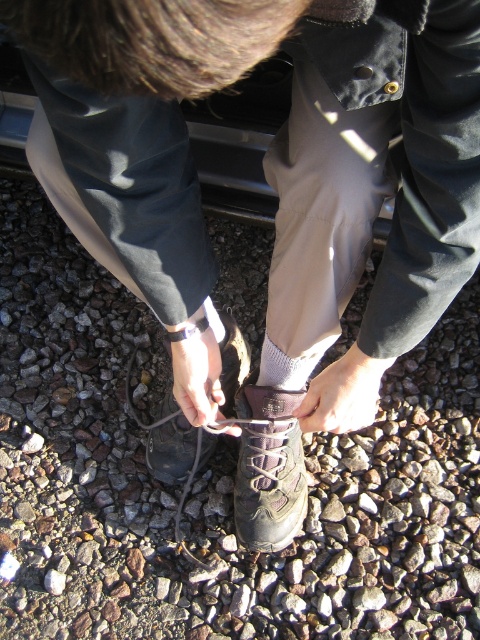
Question: Can you confirm if gray gravel at center is positioned to the left of metallic gray car at center?

Choices:
 (A) no
 (B) yes

Answer: (B)

Question: Which of the following is the closest to the observer?

Choices:
 (A) (295, 467)
 (B) (87, 616)
 (C) (4, 140)
 (D) (162, 406)

Answer: (B)

Question: Which of the following is the closest to the observer?

Choices:
 (A) gray gravel at center
 (B) leather lace-up shoe at center

Answer: (B)

Question: Does gray gravel at center have a larger size compared to leather lace-up shoe at center?

Choices:
 (A) no
 (B) yes

Answer: (B)

Question: Does brown suede boot at center have a greater width compared to leather lace-up shoe at center?

Choices:
 (A) yes
 (B) no

Answer: (B)

Question: Which of the following is the farthest from the observer?

Choices:
 (A) metallic gray car at center
 (B) gray gravel at center
 (C) brown suede boot at center
 (D) leather lace-up shoe at center

Answer: (C)